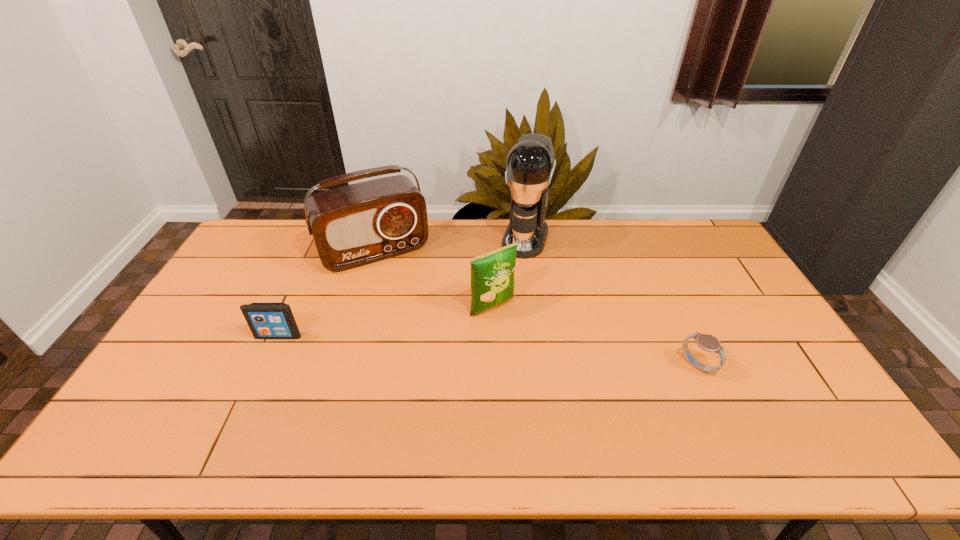
At what (x,y) coordinates should I click in order to perform the action: click on vacant area that lies between the fourth shortest object and the fourth farthest object. Please return your answer as a coordinate pair (x, y). Looking at the image, I should click on (326, 294).

The image size is (960, 540). I want to click on unoccupied position between the second shortest object and the crisp (potato chip), so point(386,322).

Identify the location of vacant space in between the shortest object and the third nearest object. (595, 336).

The height and width of the screenshot is (540, 960). What are the coordinates of `vacant region between the coffee maker and the second tallest object` in the screenshot? It's located at (450, 245).

Select which object appears as the third closest to the coffee maker. Please provide its 2D coordinates. Your answer should be formatted as a tuple, i.e. [(x, y)], where the tuple contains the x and y coordinates of a point satisfying the conditions above.

[(709, 343)]

At what (x,y) coordinates should I click in order to perform the action: click on the third closest object to the second nearest object. Please return your answer as a coordinate pair (x, y). Looking at the image, I should click on tap(530, 164).

Locate an element on the screen. free space that satisfies the following two spatial constraints: 1. on the front screen of the second nearest object; 2. on the right side of the nearest object is located at coordinates (265, 366).

At what (x,y) coordinates should I click in order to perform the action: click on vacant space that satisfies the following two spatial constraints: 1. on the front screen of the second shortest object; 2. on the left side of the watch. Please return your answer as a coordinate pair (x, y). Looking at the image, I should click on tap(265, 366).

Locate an element on the screen. vacant space that satisfies the following two spatial constraints: 1. on the front side of the second tallest object; 2. on the right side of the third farthest object is located at coordinates (358, 307).

Image resolution: width=960 pixels, height=540 pixels. I want to click on vacant region that satisfies the following two spatial constraints: 1. on the front screen of the nearest object; 2. on the right side of the iPod, so click(x=265, y=366).